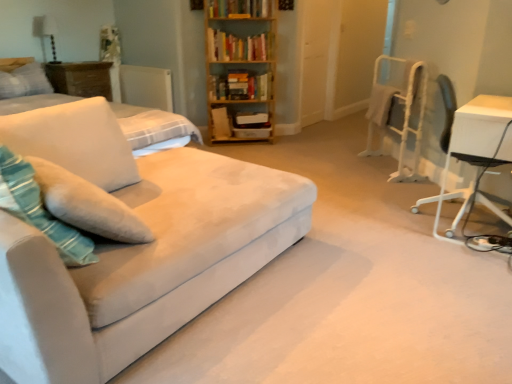
Where is `free spot in front of wooden bookcase at upper center`? The width and height of the screenshot is (512, 384). free spot in front of wooden bookcase at upper center is located at coordinates pyautogui.click(x=250, y=153).